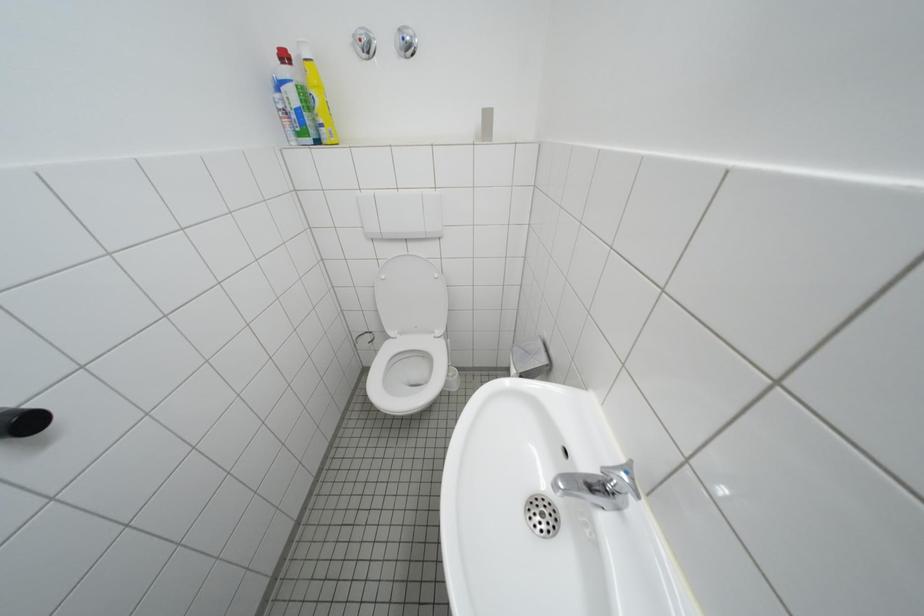
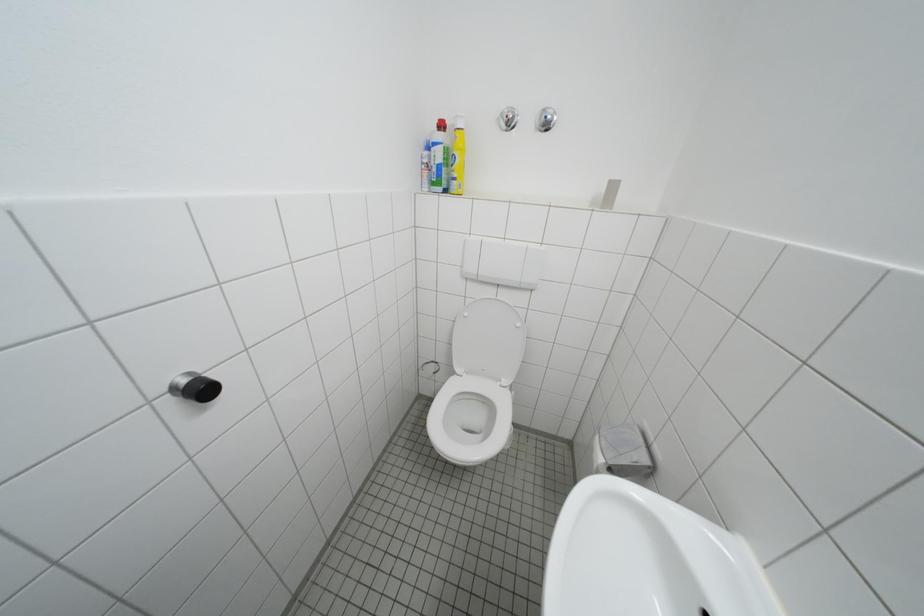
Question: What movement of the cameraman would produce the second image?

Choices:
 (A) Left
 (B) Right
 (C) Forward
 (D) Backward

Answer: (A)